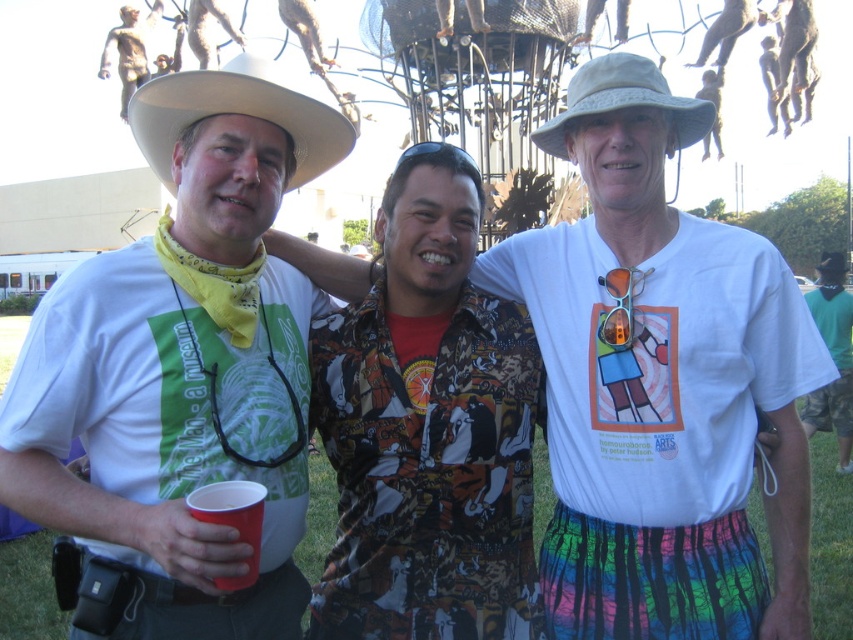
You are trying to locate the white cotton shirt at center in the image. Based on the coordinates provided, where exactly would you find it?

The white cotton shirt at center is located at point 0.600 in the x coordinate and 0.775 in the y coordinate.